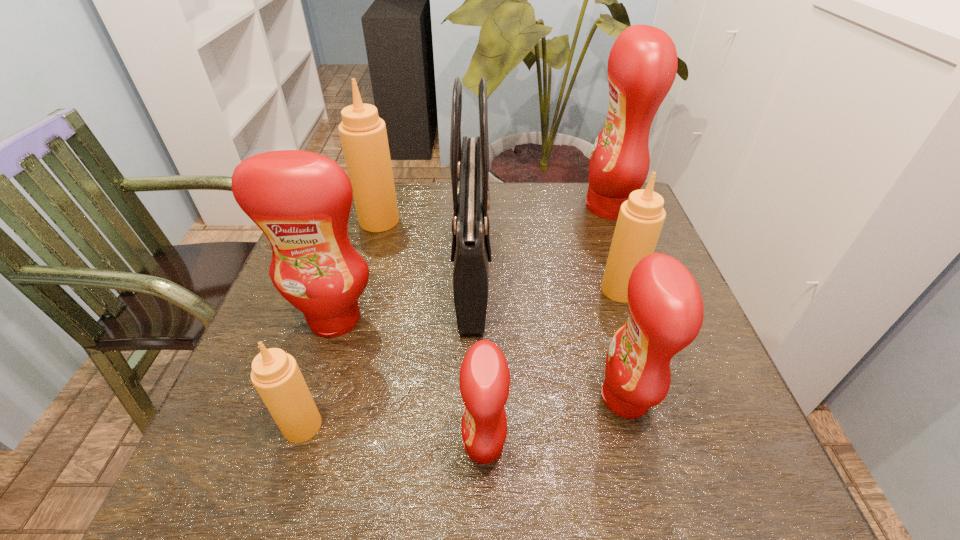
This screenshot has height=540, width=960. I want to click on vacant area between the rightmost tan condiment and the second red condiment from left to right, so click(552, 367).

Locate an element on the screen. free space between the biggest red condiment and the nearest tan condiment is located at coordinates (456, 316).

Identify which object is the sixth closest to the biggest tan condiment. Please provide its 2D coordinates. Your answer should be formatted as a tuple, i.e. [(x, y)], where the tuple contains the x and y coordinates of a point satisfying the conditions above.

[(484, 380)]

Select which object is the fifth closest to the biggest tan condiment. Please provide its 2D coordinates. Your answer should be formatted as a tuple, i.e. [(x, y)], where the tuple contains the x and y coordinates of a point satisfying the conditions above.

[(641, 217)]

Image resolution: width=960 pixels, height=540 pixels. I want to click on condiment object that ranks as the third closest to the smallest tan condiment, so click(x=666, y=310).

Locate an element on the screen. This screenshot has width=960, height=540. condiment that is the closest to the third biggest red condiment is located at coordinates (641, 217).

Select which red condiment appears as the third closest to the second smallest red condiment. Please provide its 2D coordinates. Your answer should be formatted as a tuple, i.e. [(x, y)], where the tuple contains the x and y coordinates of a point satisfying the conditions above.

[(301, 200)]

This screenshot has width=960, height=540. Find the location of `red condiment that stands as the closest to the second nearest tan condiment`. red condiment that stands as the closest to the second nearest tan condiment is located at coordinates (666, 310).

Find the location of a particular element. Image resolution: width=960 pixels, height=540 pixels. tan condiment that stands as the second closest to the handbag is located at coordinates (641, 217).

Find the location of a particular element. The image size is (960, 540). tan condiment that is the closest one to the second smallest tan condiment is located at coordinates click(363, 134).